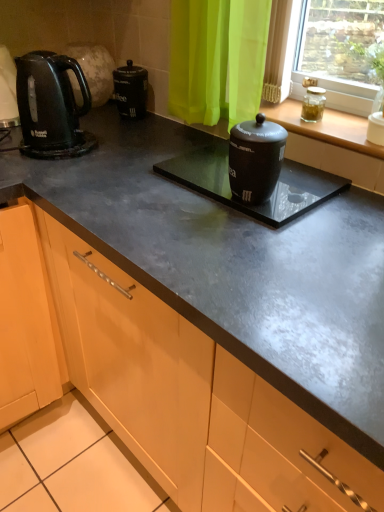
Locate an element on the screen. The height and width of the screenshot is (512, 384). free space in front of clear glass jar at upper right, which ranks as the 1th appliance in top-to-bottom order is located at coordinates (331, 129).